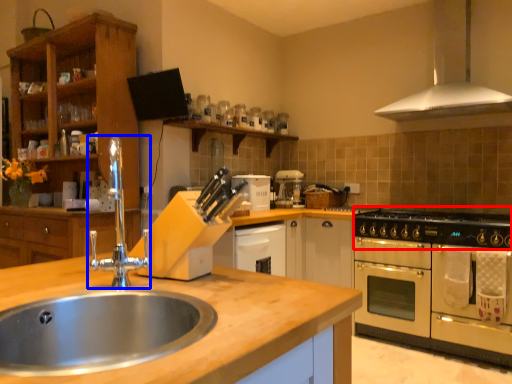
Question: Which object appears farthest to the camera in this image, gas stove (highlighted by a red box) or tap (highlighted by a blue box)?

Choices:
 (A) gas stove
 (B) tap

Answer: (A)